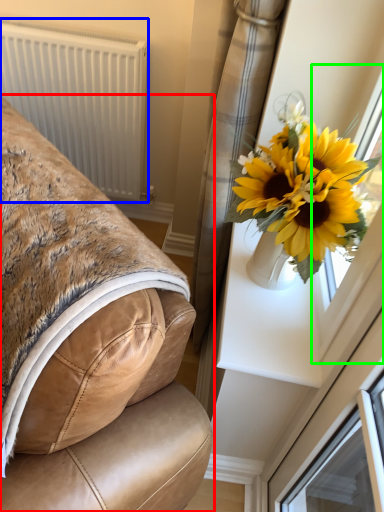
Question: Which object is the closest to the furniture (highlighted by a red box)? Choose among these: radiator (highlighted by a blue box) or window frame (highlighted by a green box).

Choices:
 (A) radiator
 (B) window frame

Answer: (B)